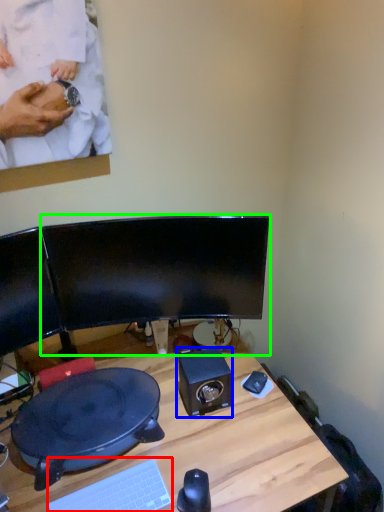
Question: Based on their relative distances, which object is nearer to computer keyboard (highlighted by a red box)? Choose from speaker (highlighted by a blue box) and computer monitor (highlighted by a green box).

Choices:
 (A) speaker
 (B) computer monitor

Answer: (A)